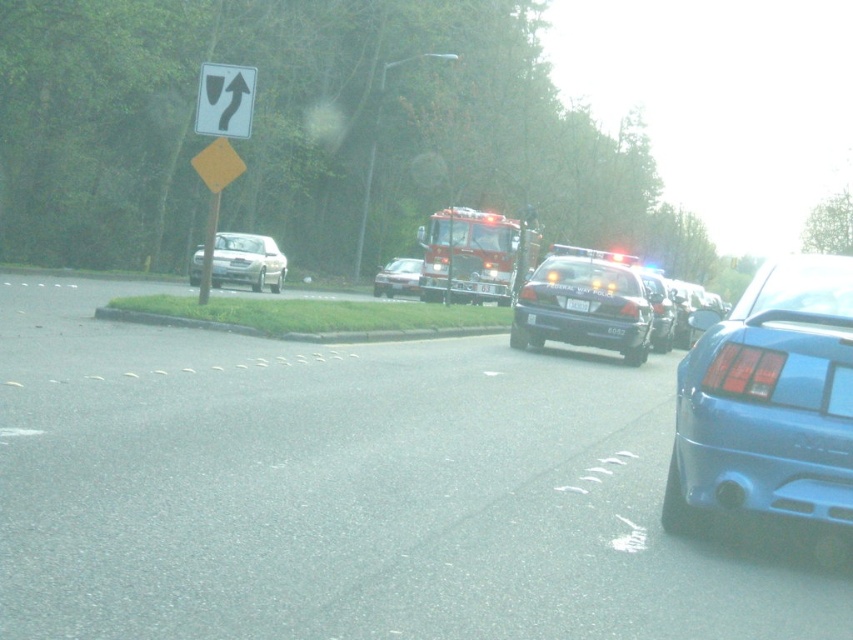
Is satin silver sedan at left positioned before silver metallic sedan at center?

Yes, satin silver sedan at left is in front of silver metallic sedan at center.

Can you confirm if satin silver sedan at left is positioned to the right of silver metallic sedan at center?

In fact, satin silver sedan at left is to the left of silver metallic sedan at center.

This screenshot has height=640, width=853. What do you see at coordinates (247, 260) in the screenshot?
I see `satin silver sedan at left` at bounding box center [247, 260].

You are a GUI agent. You are given a task and a screenshot of the screen. Output one action in this format:
    pyautogui.click(x=<x>, y=<y>)
    Task: Click on the satin silver sedan at left
    
    Given the screenshot: What is the action you would take?
    (x=247, y=260)

Is point (515, 346) positioned before point (245, 112)?

No, (515, 346) is further to viewer.

Does metallic blue police car at center have a lesser width compared to white plastic traffic sign at upper left?

In fact, metallic blue police car at center might be wider than white plastic traffic sign at upper left.

Identify the location of metallic blue police car at center. This screenshot has width=853, height=640. (589, 305).

Is red metallic fire truck at center further to the viewer compared to black plastic license plate at center?

Yes, it is behind black plastic license plate at center.

Does point (424, 225) come in front of point (579, 300)?

No, (424, 225) is further to viewer.

Is point (497, 214) positioned before point (572, 298)?

That is False.

I want to click on red metallic fire truck at center, so click(474, 256).